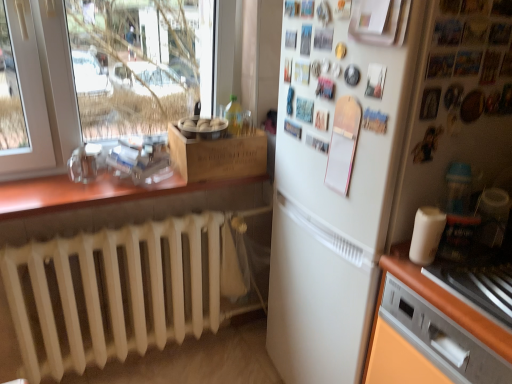
You are a GUI agent. You are given a task and a screenshot of the screen. Output one action in this format:
    pyautogui.click(x=<x>, y=<y>)
    Task: Click on the free spot above wooden crate at center (from a real-world perspective)
    The height and width of the screenshot is (384, 512).
    Given the screenshot: What is the action you would take?
    pyautogui.click(x=217, y=131)